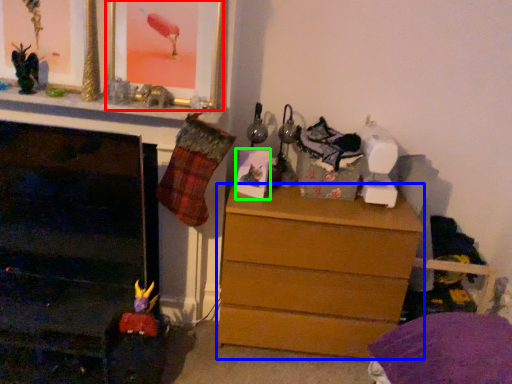
Question: Considering the real-world distances, which object is farthest from picture frame (highlighted by a red box)? chest of drawers (highlighted by a blue box) or picture frame (highlighted by a green box)?

Choices:
 (A) chest of drawers
 (B) picture frame

Answer: (A)